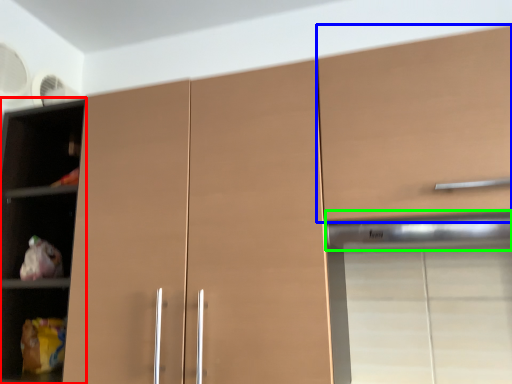
Question: Based on their relative distances, which object is farther from cupboard (highlighted by a red box)? Choose from cabinetry (highlighted by a blue box) and exhaust hood (highlighted by a green box).

Choices:
 (A) cabinetry
 (B) exhaust hood

Answer: (B)